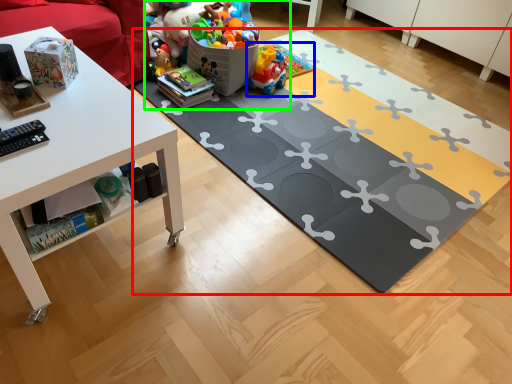
Question: Which object is the closest to the yoga mat (highlighted by a red box)? Choose among these: toy (highlighted by a blue box) or toy (highlighted by a green box).

Choices:
 (A) toy
 (B) toy

Answer: (B)